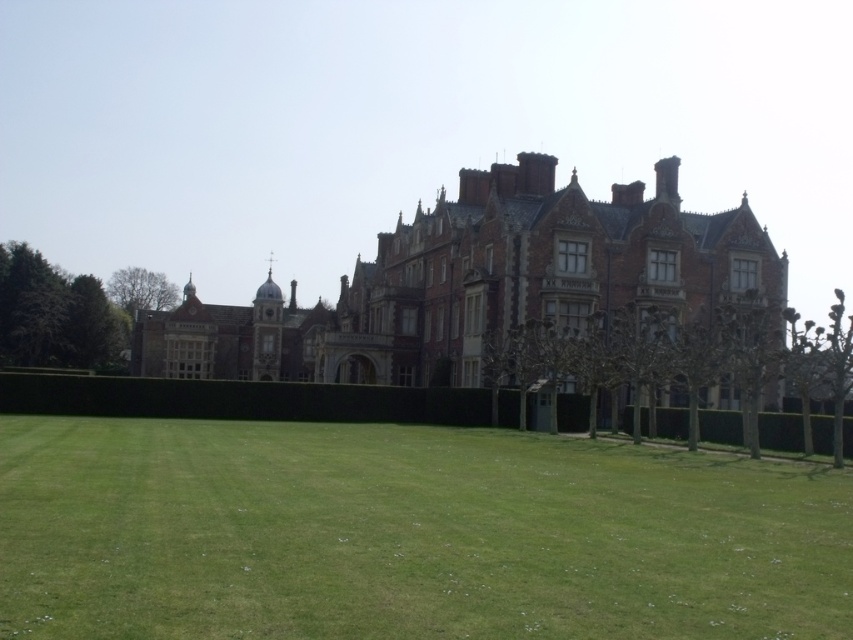
You are standing in front of the grand historic building and want to walk towards the green grass at lower center. What direction should you move relative to your current position?

Since the green grass at lower center is located at coordinates approximately 0.836 on the x axis and 0.478 on the y axis, you should move forward and slightly to the right to reach it.

You are standing on the lawn in front of the historic building. You want to walk towards the brown brick mansion at center. Which direction should you move relative to the green grass at lower center?

Since the green grass at lower center is closer to the viewer than the brown brick mansion at center, you should move away from the green grass at lower center towards the mansion.

You are standing at the point marked by the coordinates point (407, 534). Based on the scene, what is the immediate surface beneath your feet?

The immediate surface beneath your feet at point (407, 534) is green grass at lower center.